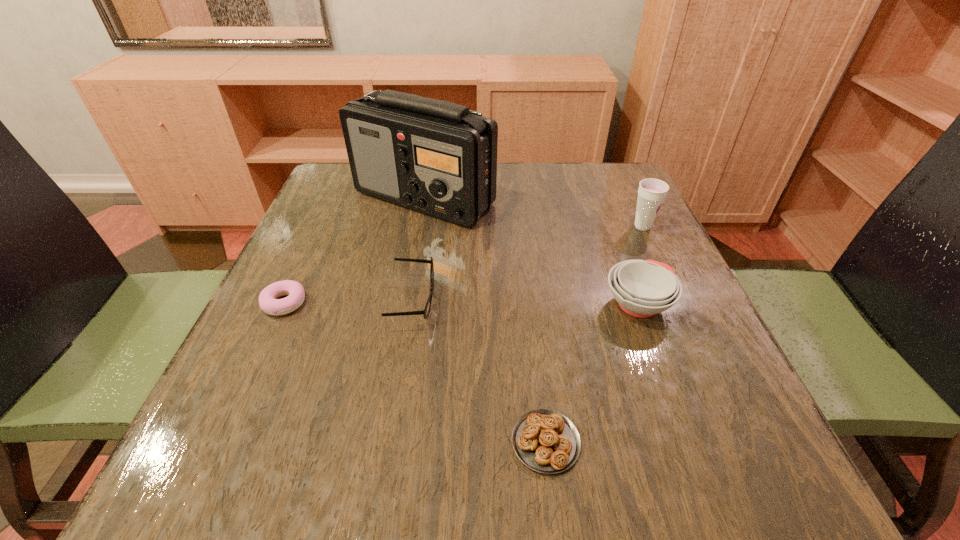
The image size is (960, 540). I want to click on vacant space located on the back of the fourth shortest object, so click(592, 181).

This screenshot has height=540, width=960. Identify the location of vacant space situated on the front-facing side of the spectacles. click(x=520, y=302).

The image size is (960, 540). In order to click on vacant region located on the front of the farther pastry in this screenshot , I will do `click(263, 349)`.

Where is `free region located 0.230m on the right of the nearest object`? The height and width of the screenshot is (540, 960). free region located 0.230m on the right of the nearest object is located at coordinates (742, 442).

Image resolution: width=960 pixels, height=540 pixels. Find the location of `object located in the far edge section of the desktop`. object located in the far edge section of the desktop is located at coordinates (439, 158).

Identify the location of object that is at the near edge. (546, 441).

This screenshot has width=960, height=540. Identify the location of radio receiver present at the left edge. (439, 158).

At what (x,y) coordinates should I click in order to perform the action: click on pastry present at the left edge. Please return your answer as a coordinate pair (x, y). Looking at the image, I should click on (268, 301).

Find the location of a particular element. Image resolution: width=960 pixels, height=540 pixels. cup that is at the right edge is located at coordinates (651, 193).

Where is `soup bowl that is at the right edge`? soup bowl that is at the right edge is located at coordinates (642, 288).